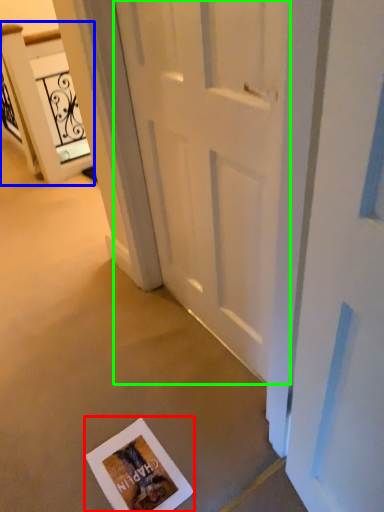
Question: Considering the real-world distances, which object is closest to postcard (highlighted by a red box)? elevator (highlighted by a blue box) or door (highlighted by a green box).

Choices:
 (A) elevator
 (B) door

Answer: (B)